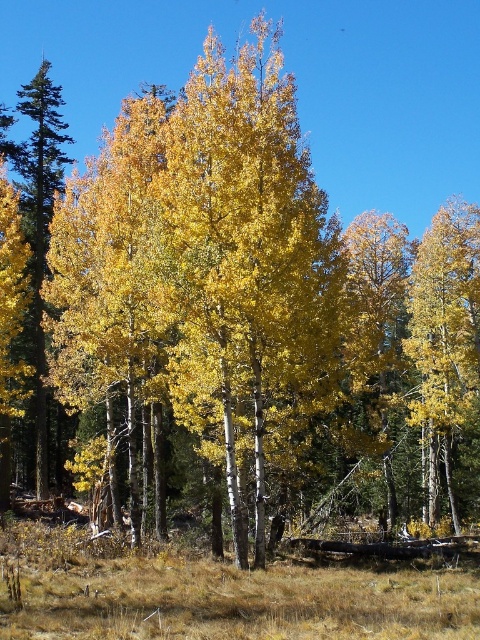
Question: Which of the following is the closest to the observer?

Choices:
 (A) yellow matte tree at center
 (B) smooth green pine tree at left

Answer: (B)

Question: Which object is farther from the camera taking this photo?

Choices:
 (A) yellow matte tree at center
 (B) smooth green pine tree at left

Answer: (A)

Question: Where is yellow matte tree at center located in relation to smooth green pine tree at left in the image?

Choices:
 (A) left
 (B) right

Answer: (B)

Question: Observing the image, what is the correct spatial positioning of yellow matte tree at center in reference to smooth green pine tree at left?

Choices:
 (A) below
 (B) above

Answer: (A)

Question: Can you confirm if yellow matte tree at center is positioned to the left of smooth green pine tree at left?

Choices:
 (A) yes
 (B) no

Answer: (B)